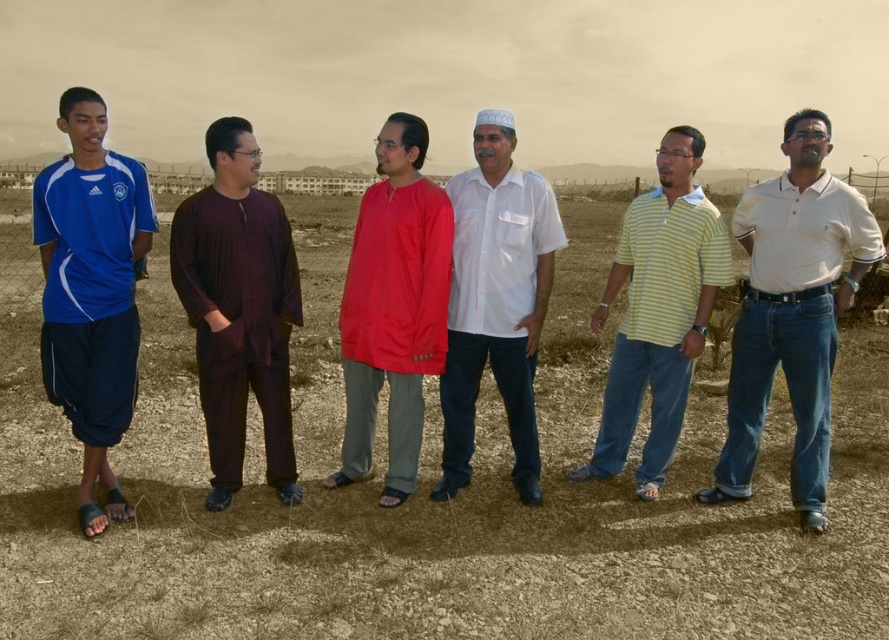
You are a photographer standing 2 meters away from the group. You want to take a photo that includes both the white cotton shirt at center and the yellow striped polo shirt at center without any part of them being cut off. What is the minimum width of the camera lens you need to use?

The white cotton shirt at center and yellow striped polo shirt at center are 74.62 centimeters apart. To capture both without cropping, the camera lens must have a minimum width of at least 74.62 centimeters.

You are trying to find the person wearing a white cotton polo shirt at center in the group. Which direction should you look relative to the white cotton shirt at center?

The white cotton polo shirt at center is to the right of the white cotton shirt at center, so you should look to the right of the white cotton shirt at center to find the person wearing the white cotton polo shirt at center.

You are standing at the position of the person wearing the white cotton polo shirt at center. You want to take a photo of the camera that is 4.55 meters away. Is the camera within the typical range of a standard camera lens? Please explain your reasoning.

The camera is 4.55 meters away from the white cotton polo shirt at center. A standard camera lens has a typical focusing range that can easily accommodate distances of several meters. Since 4.55 meters is well within this range, the camera can be clearly photographed without any issues related to distance.